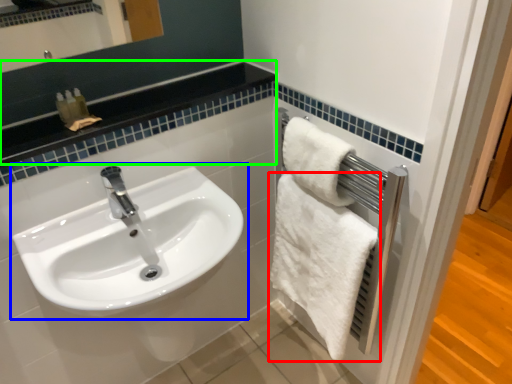
Question: Based on their relative distances, which object is nearer to towel (highlighted by a red box)? Choose from sink (highlighted by a blue box) and balustrade (highlighted by a green box).

Choices:
 (A) sink
 (B) balustrade

Answer: (A)